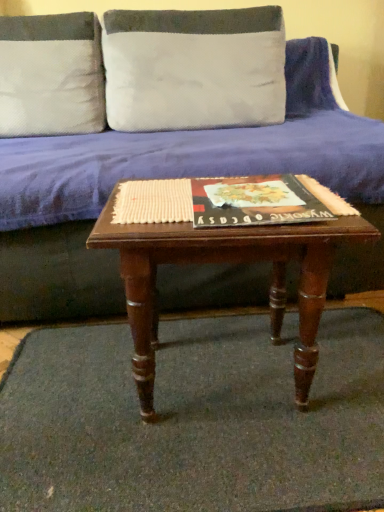
You are a GUI agent. You are given a task and a screenshot of the screen. Output one action in this format:
    pyautogui.click(x=<x>, y=<y>)
    Task: Click on the mahogany wood coffee table at center
    The image size is (384, 512).
    Given the screenshot: What is the action you would take?
    pyautogui.click(x=225, y=262)

Where is `white textured pillow at upper center, placed as the 2th pillow when sorted from left to right`? white textured pillow at upper center, placed as the 2th pillow when sorted from left to right is located at coordinates [194, 68].

Image resolution: width=384 pixels, height=512 pixels. What do you see at coordinates (194, 68) in the screenshot?
I see `white textured pillow at upper center, placed as the 2th pillow when sorted from left to right` at bounding box center [194, 68].

Where is `blue fabric couch at center`? blue fabric couch at center is located at coordinates (57, 276).

The width and height of the screenshot is (384, 512). Describe the element at coordinates (57, 276) in the screenshot. I see `blue fabric couch at center` at that location.

Locate an element on the screen. matte black book at center is located at coordinates (255, 201).

This screenshot has height=512, width=384. What are the coordinates of `green carpet at center` in the screenshot? It's located at (195, 419).

What are the coordinates of `mahogany wood coffee table at center` in the screenshot? It's located at (225, 262).

Considering the sizes of objects mahogany wood coffee table at center and matte black book at center in the image provided, who is thinner, mahogany wood coffee table at center or matte black book at center?

matte black book at center is thinner.

Is matte black book at center at the back of mahogany wood coffee table at center?

No, mahogany wood coffee table at center's orientation is not away from matte black book at center.

From a real-world perspective, is mahogany wood coffee table at center physically located above or below matte black book at center?

mahogany wood coffee table at center is below matte black book at center.

Is mahogany wood coffee table at center taller or shorter than matte black book at center?

mahogany wood coffee table at center is taller than matte black book at center.

Considering the sizes of objects white textured pillow at upper center, placed as the 2th pillow when sorted from left to right, and mahogany wood coffee table at center in the image provided, who is smaller, white textured pillow at upper center, placed as the 2th pillow when sorted from left to right, or mahogany wood coffee table at center?

Smaller between the two is white textured pillow at upper center, placed as the 2th pillow when sorted from left to right.

Is white textured pillow at upper center, placed as the first pillow when sorted from right to left, in contact with mahogany wood coffee table at center?

No, white textured pillow at upper center, placed as the first pillow when sorted from right to left, is not in contact with mahogany wood coffee table at center.

From the image's perspective, which object appears higher, white textured pillow at upper center, placed as the 2th pillow when sorted from left to right, or mahogany wood coffee table at center?

white textured pillow at upper center, placed as the 2th pillow when sorted from left to right, from the image's perspective.

Is white textured pillow at upper left, marked as the first pillow in a left-to-right arrangement, next to green carpet at center and touching it?

No, white textured pillow at upper left, marked as the first pillow in a left-to-right arrangement, is not in contact with green carpet at center.

Considering the relative positions of white textured pillow at upper left, the 2th pillow from the right, and green carpet at center in the image provided, is white textured pillow at upper left, the 2th pillow from the right, to the right of green carpet at center from the viewer's perspective?

Incorrect, white textured pillow at upper left, the 2th pillow from the right, is not on the right side of green carpet at center.

Could green carpet at center be considered to be inside white textured pillow at upper left, the 2th pillow from the right?

No.

Looking at their sizes, would you say white textured pillow at upper left, marked as the first pillow in a left-to-right arrangement, is wider or thinner than green carpet at center?

white textured pillow at upper left, marked as the first pillow in a left-to-right arrangement, is thinner than green carpet at center.

Would you say green carpet at center is inside or outside white textured pillow at upper left, the 2th pillow from the right?

green carpet at center cannot be found inside white textured pillow at upper left, the 2th pillow from the right.

Is green carpet at center touching white textured pillow at upper left, the 2th pillow from the right?

green carpet at center and white textured pillow at upper left, the 2th pillow from the right, are not in contact.

Measure the distance from green carpet at center to white textured pillow at upper left, the 2th pillow from the right.

The distance of green carpet at center from white textured pillow at upper left, the 2th pillow from the right, is 1.04 meters.

From the image's perspective, would you say mahogany wood coffee table at center is positioned over white textured pillow at upper center, placed as the 2th pillow when sorted from left to right?

No, from the image's perspective, mahogany wood coffee table at center is not on top of white textured pillow at upper center, placed as the 2th pillow when sorted from left to right.

Identify the location of coffee table that is on the right side of white textured pillow at upper center, placed as the first pillow when sorted from right to left. (225, 262).

Considering the positions of objects mahogany wood coffee table at center and white textured pillow at upper center, placed as the 2th pillow when sorted from left to right, in the image provided, who is more to the right, mahogany wood coffee table at center or white textured pillow at upper center, placed as the 2th pillow when sorted from left to right,?

Positioned to the right is mahogany wood coffee table at center.

Which is less distant, (34, 32) or (91, 268)?

The point (91, 268) is closer.

Does white textured pillow at upper left, the 2th pillow from the right, contain blue fabric couch at center?

No, blue fabric couch at center is not surrounded by white textured pillow at upper left, the 2th pillow from the right.

From the image's perspective, is white textured pillow at upper left, the 2th pillow from the right, above or below blue fabric couch at center?

white textured pillow at upper left, the 2th pillow from the right, is situated higher than blue fabric couch at center in the image.

From the image's perspective, is blue fabric couch at center above or below green carpet at center?

blue fabric couch at center is situated higher than green carpet at center in the image.

Consider the image. Does blue fabric couch at center have a lesser height compared to green carpet at center?

No, blue fabric couch at center is not shorter than green carpet at center.

Is blue fabric couch at center far from green carpet at center?

No, blue fabric couch at center is not far away from green carpet at center.

I want to click on coffee table that appears in front of the matte black book at center, so pyautogui.click(x=225, y=262).

Locate an element on the screen. This screenshot has width=384, height=512. the 1st pillow counting from the left side of the mahogany wood coffee table at center is located at coordinates (194, 68).

When comparing their distances from white textured pillow at upper left, the 2th pillow from the right, does green carpet at center or mahogany wood coffee table at center seem further?

green carpet at center.

Which object lies further to the anchor point white textured pillow at upper left, the 2th pillow from the right, green carpet at center or white textured pillow at upper center, placed as the first pillow when sorted from right to left?

green carpet at center lies further to white textured pillow at upper left, the 2th pillow from the right, than the other object.

Which object lies further to the anchor point white textured pillow at upper center, placed as the 2th pillow when sorted from left to right, white textured pillow at upper left, marked as the first pillow in a left-to-right arrangement, or blue fabric couch at center?

Among the two, blue fabric couch at center is located further to white textured pillow at upper center, placed as the 2th pillow when sorted from left to right.

Considering their positions, is white textured pillow at upper center, placed as the 2th pillow when sorted from left to right, positioned further to white textured pillow at upper left, marked as the first pillow in a left-to-right arrangement, than green carpet at center?

green carpet at center.

When comparing their distances from white textured pillow at upper center, placed as the first pillow when sorted from right to left, does mahogany wood coffee table at center or blue fabric couch at center seem further?

The object further to white textured pillow at upper center, placed as the first pillow when sorted from right to left, is mahogany wood coffee table at center.

Estimate the real-world distances between objects in this image. Which object is further from white textured pillow at upper left, marked as the first pillow in a left-to-right arrangement, mahogany wood coffee table at center or blue fabric couch at center?

Based on the image, mahogany wood coffee table at center appears to be further to white textured pillow at upper left, marked as the first pillow in a left-to-right arrangement.

When comparing their distances from blue fabric couch at center, does green carpet at center or white textured pillow at upper left, marked as the first pillow in a left-to-right arrangement, seem further?

Based on the image, white textured pillow at upper left, marked as the first pillow in a left-to-right arrangement, appears to be further to blue fabric couch at center.

From the picture: Considering their positions, is white textured pillow at upper center, placed as the first pillow when sorted from right to left, positioned further to matte black book at center than mahogany wood coffee table at center?

white textured pillow at upper center, placed as the first pillow when sorted from right to left, is further to matte black book at center.

The width and height of the screenshot is (384, 512). What are the coordinates of `coffee table that lies between white textured pillow at upper left, the 2th pillow from the right, and green carpet at center from top to bottom` in the screenshot? It's located at (225, 262).

I want to click on paperback book between white textured pillow at upper left, marked as the first pillow in a left-to-right arrangement, and green carpet at center in the up-down direction, so click(255, 201).

Image resolution: width=384 pixels, height=512 pixels. What are the coordinates of `paperback book that lies between blue fabric couch at center and green carpet at center from top to bottom` in the screenshot? It's located at (255, 201).

At what (x,y) coordinates should I click in order to perform the action: click on studio couch located between mahogany wood coffee table at center and white textured pillow at upper center, placed as the first pillow when sorted from right to left, in the depth direction. Please return your answer as a coordinate pair (x, y). Image resolution: width=384 pixels, height=512 pixels. Looking at the image, I should click on (57, 276).